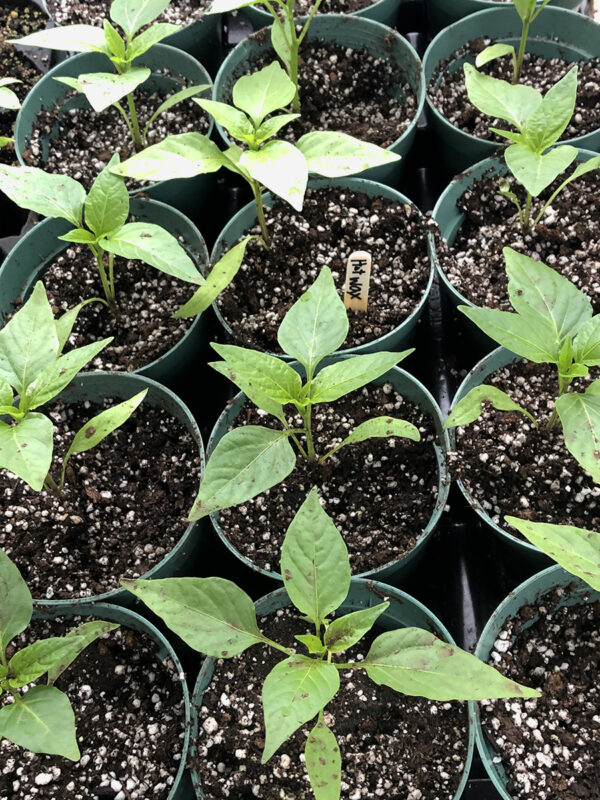
Where is `soil in pot in bottom left corner of image`? The height and width of the screenshot is (800, 600). soil in pot in bottom left corner of image is located at coordinates (109, 680).